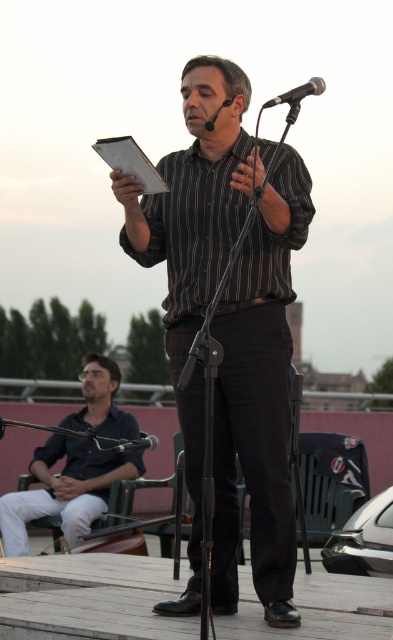
Question: Among these points, which one is nearest to the camera?

Choices:
 (A) (91, 484)
 (B) (213, 115)

Answer: (B)

Question: Which object is closer to the camera taking this photo?

Choices:
 (A) striped cotton shirt at center
 (B) black metallic microphone at center
 (C) black matte microphone at center

Answer: (B)

Question: Among these objects, which one is farthest from the camera?

Choices:
 (A) black matte microphone at center
 (B) metallic silver microphone at center
 (C) striped cotton shirt at center
 (D) dark blue shirt at lower left

Answer: (D)

Question: Can you confirm if striped cotton shirt at center is positioned to the left of dark blue shirt at lower left?

Choices:
 (A) no
 (B) yes

Answer: (A)

Question: Does striped cotton shirt at center have a smaller size compared to black matte microphone at center?

Choices:
 (A) yes
 (B) no

Answer: (B)

Question: Can you confirm if dark blue shirt at lower left is positioned to the right of black matte microphone at center?

Choices:
 (A) yes
 (B) no

Answer: (B)